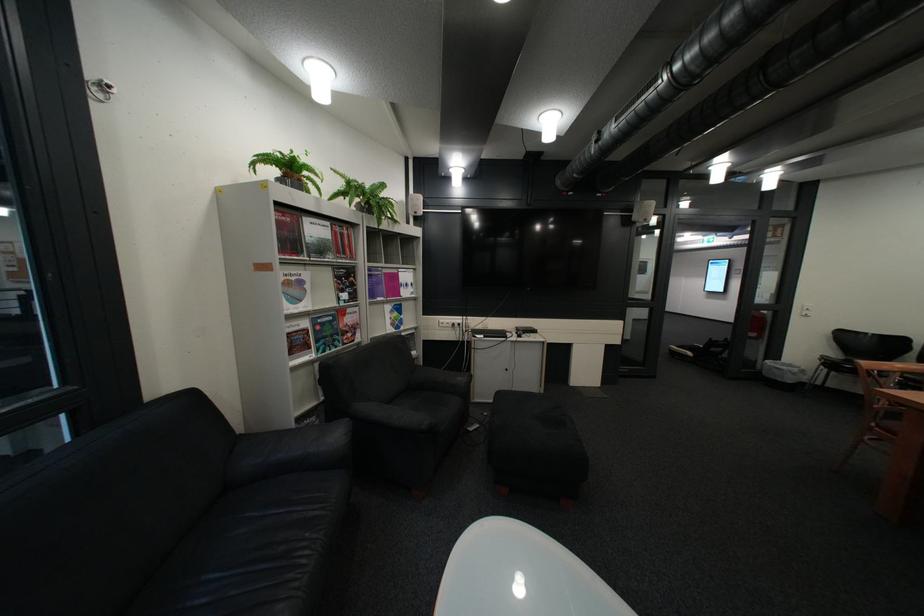
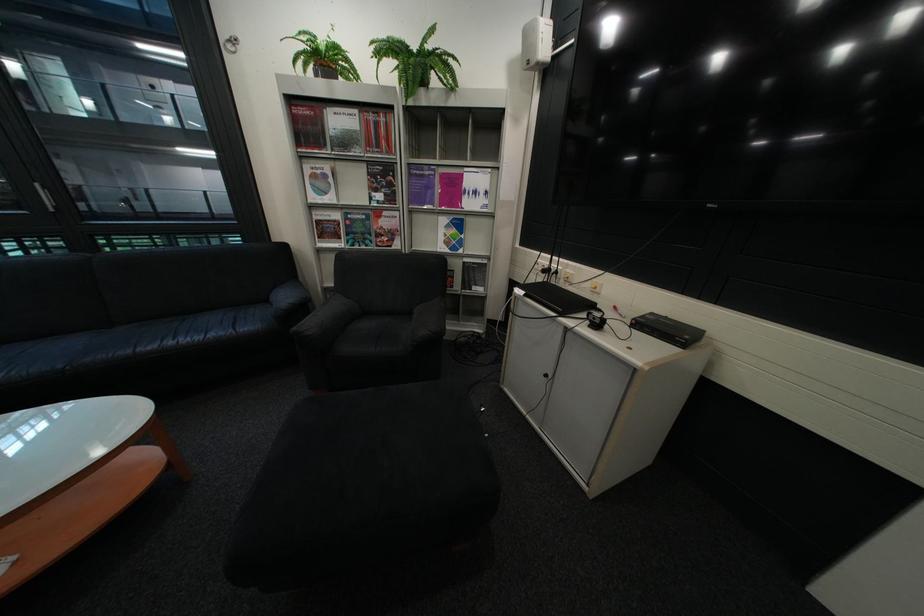
Locate, in the second image, the point that corresponds to the point at 468,325 in the first image.

(563, 270)